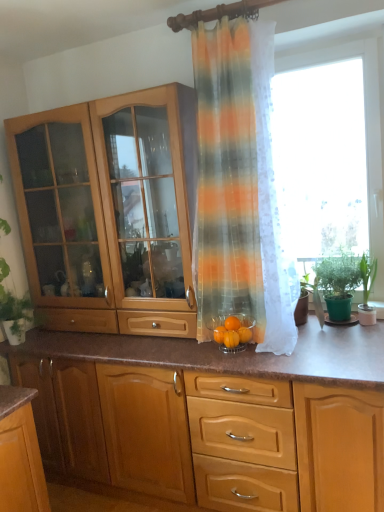
Question: From the image's perspective, is green matte plant at right, which is counted as the first houseplant, starting from the left, located above or below orange matte glass bowl at center, the first orange from the right?

Choices:
 (A) below
 (B) above

Answer: (B)

Question: Considering the positions of point (334, 317) and point (249, 337), is point (334, 317) closer or farther from the camera than point (249, 337)?

Choices:
 (A) closer
 (B) farther

Answer: (B)

Question: Based on their relative distances, which object is farther from the wooden cabinet at center, the 1th cabinetry in the bottom-to-top sequence?

Choices:
 (A) transparent fabric at right
 (B) translucent striped curtain at center
 (C) green matte plant at right, which is the 2th houseplant from right to left
 (D) light brown wood cabinet at left, the second cabinetry positioned from the bottom
 (E) green leafy plant at right, which is the 2th houseplant in left-to-right order

Answer: (A)

Question: Estimate the real-world distances between objects in this image. Which object is closer to the green matte plant at right, which is the 2th houseplant from right to left?

Choices:
 (A) transparent fabric at right
 (B) green leafy plant at right, which is the 2th houseplant in left-to-right order
 (C) light brown wood cabinet at left, marked as the 1th cabinetry in a top-to-bottom arrangement
 (D) wooden cabinet at center, which is the 2th cabinetry from top to bottom
 (E) translucent striped curtain at center

Answer: (B)